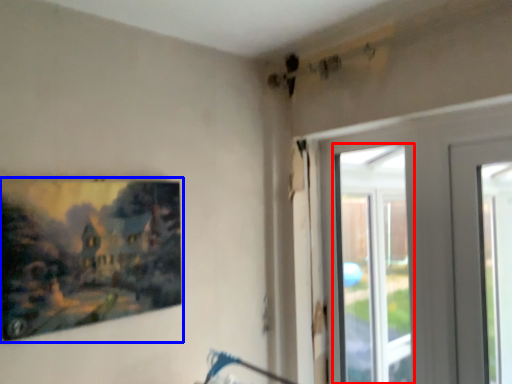
Question: Which object is further to the camera taking this photo, window (highlighted by a red box) or picture frame (highlighted by a blue box)?

Choices:
 (A) window
 (B) picture frame

Answer: (A)